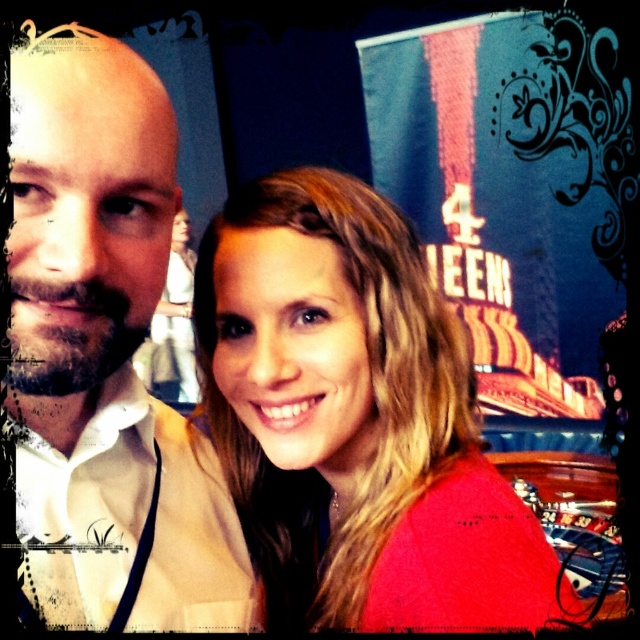
Consider the image. You are a photographer trying to capture a closeup of the two people in the scene. The camera you are using has a maximum width of 1 meter. Given that the smooth red shirt at center is wider than the white shirt at center, will both shirts fit within the camera frame if positioned side by side?

The smooth red shirt at center is wider than the white shirt at center. However, since the camera has a maximum width of 1 meter, we need to know the combined width of both shirts. Unfortunately, the exact widths arenegative not provided in the description. Therefore, it is impossible to determine if they will fit within the camera frame based on the given information.